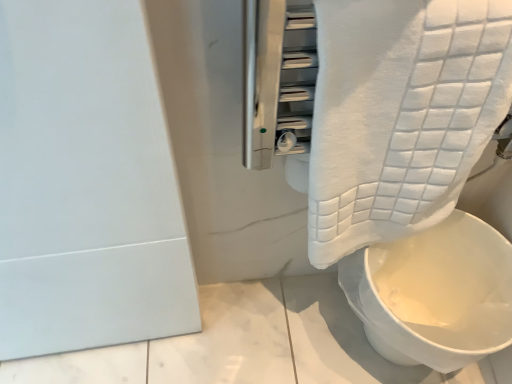
Question: Looking at the image, does white textured towel at upper right seem bigger or smaller compared to white fabric toilet at lower right?

Choices:
 (A) big
 (B) small

Answer: (B)

Question: From a real-world perspective, is white textured towel at upper right above or below white fabric toilet at lower right?

Choices:
 (A) above
 (B) below

Answer: (A)

Question: Considering the positions of point (434, 39) and point (485, 332), is point (434, 39) closer or farther from the camera than point (485, 332)?

Choices:
 (A) farther
 (B) closer

Answer: (B)

Question: From their relative heights in the image, would you say white fabric toilet at lower right is taller or shorter than white textured towel at upper right?

Choices:
 (A) tall
 (B) short

Answer: (B)

Question: From the image's perspective, is white fabric toilet at lower right above or below white textured towel at upper right?

Choices:
 (A) below
 (B) above

Answer: (A)

Question: Is white fabric toilet at lower right wider or thinner than white textured towel at upper right?

Choices:
 (A) thin
 (B) wide

Answer: (B)

Question: Based on their sizes in the image, would you say white fabric toilet at lower right is bigger or smaller than white textured towel at upper right?

Choices:
 (A) big
 (B) small

Answer: (A)